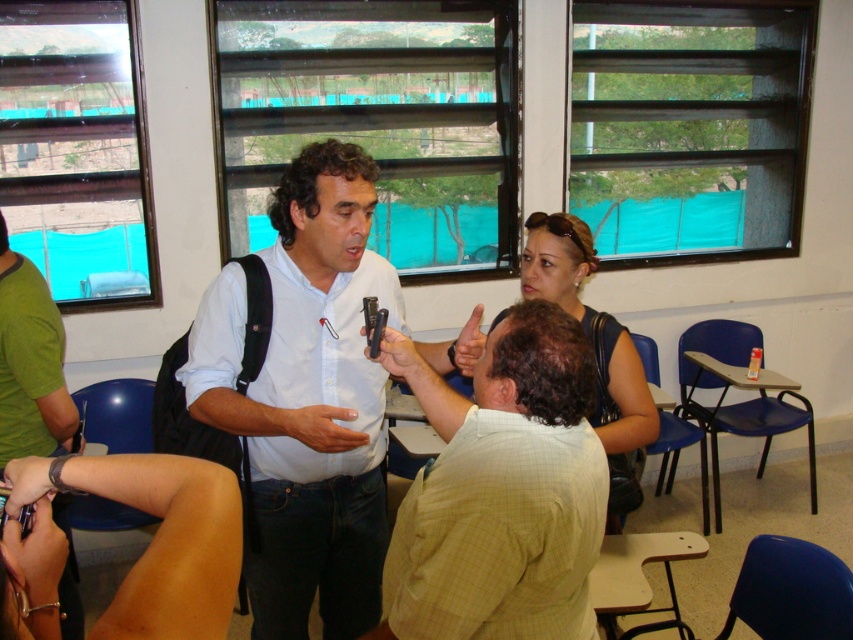
Question: Among these objects, which one is nearest to the camera?

Choices:
 (A) matte black wristwatch at lower left
 (B) matte black hand at center
 (C) metallic silver pen at lower left

Answer: (C)

Question: Which object is positioned farthest from the light brown checkered shirt at center?

Choices:
 (A) matte black phone at center
 (B) white shirt at center
 (C) matte black wristwatch at lower left
 (D) smooth skin hand at center

Answer: (C)

Question: Does white shirt at center appear on the right side of matte black phone at center?

Choices:
 (A) yes
 (B) no

Answer: (B)

Question: Which of the following is the closest to the observer?

Choices:
 (A) white shirt at center
 (B) matte black phone at center

Answer: (A)

Question: Does light brown checkered shirt at center appear on the right side of matte black phone at center?

Choices:
 (A) no
 (B) yes

Answer: (B)

Question: Is smooth tan skin at lower left thinner than smooth skin hand at center?

Choices:
 (A) no
 (B) yes

Answer: (A)